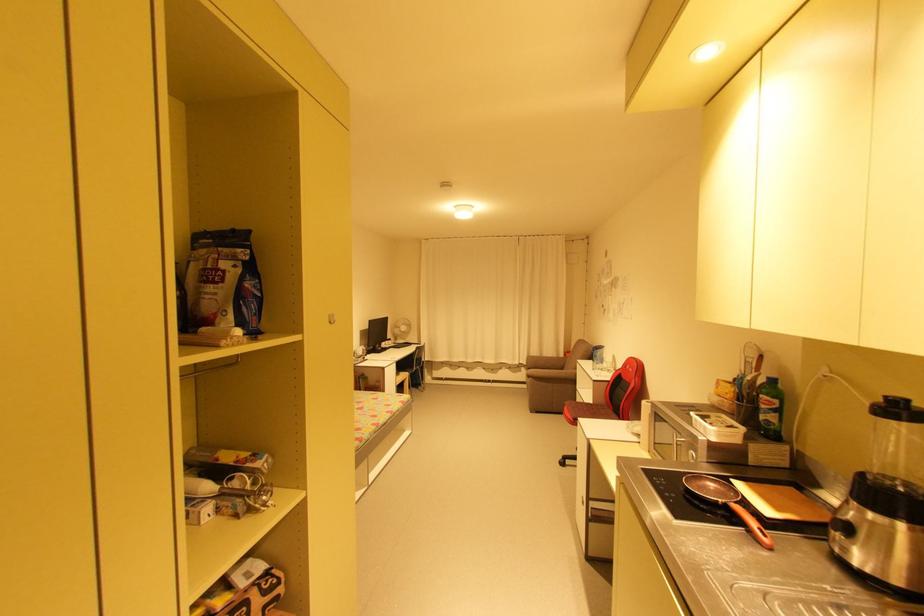
Locate an element on the screen. small white hook is located at coordinates (331, 318).